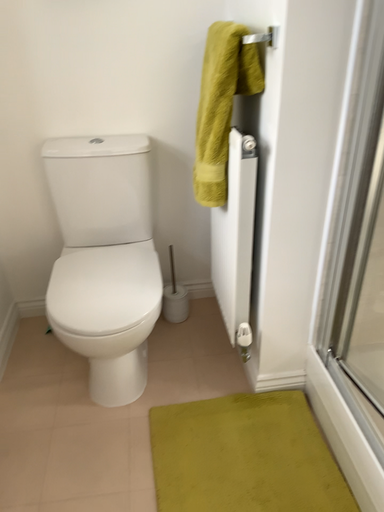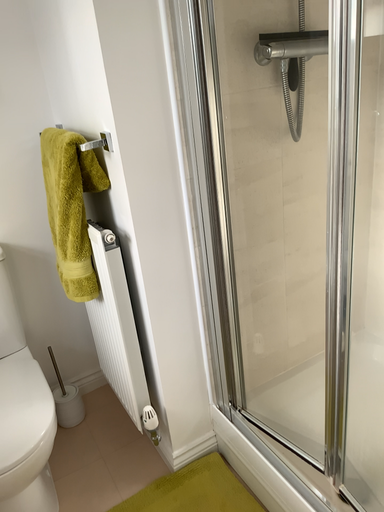
Question: How did the camera likely rotate when shooting the video?

Choices:
 (A) rotated left
 (B) rotated right

Answer: (B)